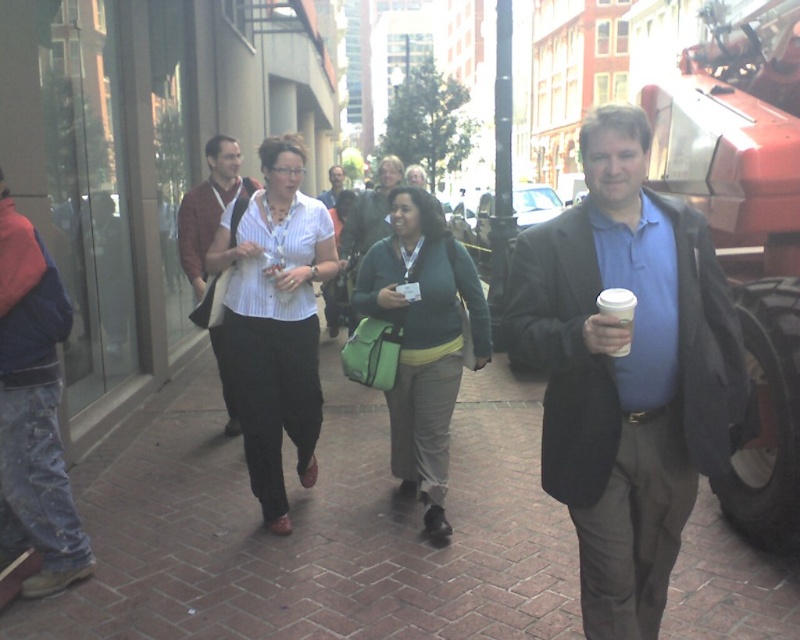
Question: Does blue cotton shirt at center appear on the right side of matte brown jacket at center?

Choices:
 (A) no
 (B) yes

Answer: (B)

Question: Which object is farther from the camera taking this photo?

Choices:
 (A) brick pavement at center
 (B) denim jacket at left
 (C) white paper cup at right
 (D) blue cotton shirt at center

Answer: (A)

Question: Which of these objects is positioned closest to the brick pavement at center?

Choices:
 (A) green fabric bag at center
 (B) white paper cup at right

Answer: (A)

Question: Does white striped shirt at center have a smaller size compared to white paper cup at right?

Choices:
 (A) no
 (B) yes

Answer: (A)

Question: Which point is farther to the camera?

Choices:
 (A) matte brown jacket at center
 (B) denim jacket at left
 (C) green fabric bag at center
 (D) white paper cup at right

Answer: (A)

Question: Is matte brown jacket at center further to the viewer compared to matte white shirt at center?

Choices:
 (A) yes
 (B) no

Answer: (B)